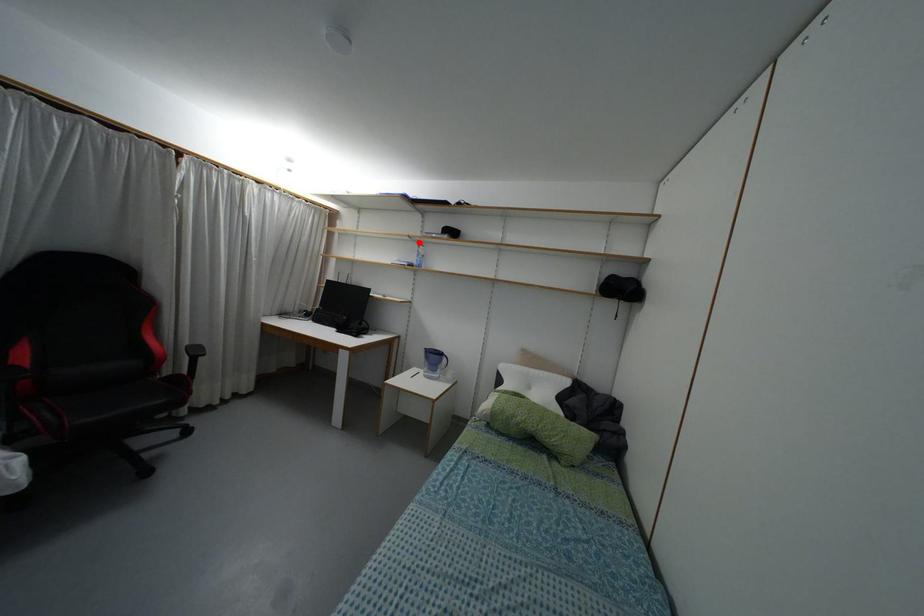
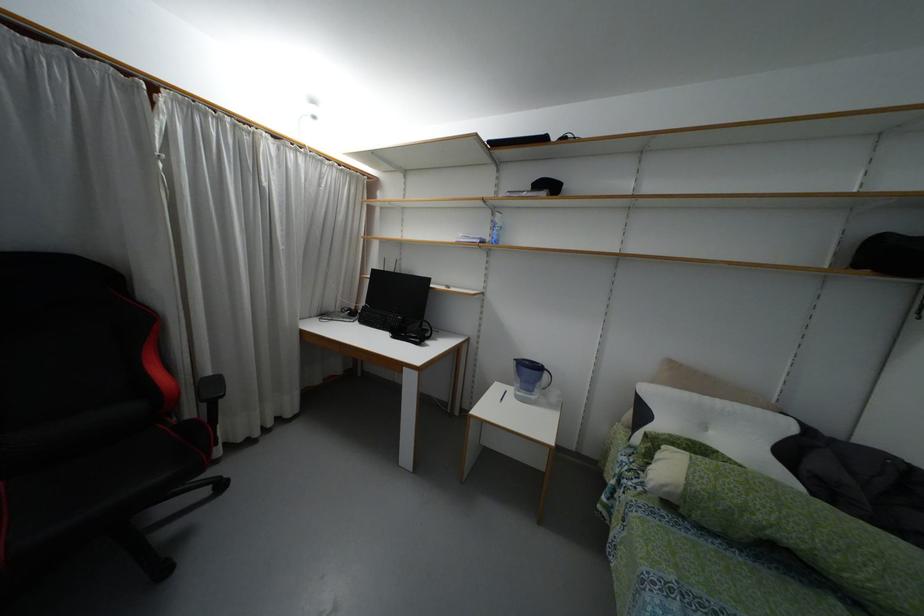
Find the pixel in the second image that matches the highlighted location in the first image.

(493, 209)